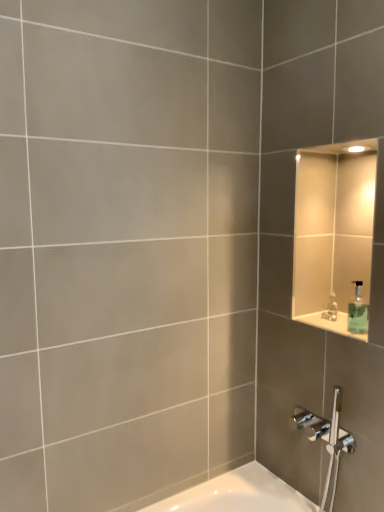
Question: Is green translucent soap dispenser at upper right at the right side of silver metallic faucet at upper right?

Choices:
 (A) no
 (B) yes

Answer: (B)

Question: Is green translucent soap dispenser at upper right further to the viewer compared to silver metallic faucet at upper right?

Choices:
 (A) no
 (B) yes

Answer: (A)

Question: Are green translucent soap dispenser at upper right and silver metallic faucet at upper right far apart?

Choices:
 (A) yes
 (B) no

Answer: (B)

Question: Does green translucent soap dispenser at upper right have a greater height compared to silver metallic faucet at upper right?

Choices:
 (A) yes
 (B) no

Answer: (A)

Question: Considering the relative positions of green translucent soap dispenser at upper right and silver metallic faucet at upper right in the image provided, is green translucent soap dispenser at upper right to the left of silver metallic faucet at upper right from the viewer's perspective?

Choices:
 (A) no
 (B) yes

Answer: (A)

Question: From the image's perspective, is green translucent soap dispenser at upper right on silver metallic faucet at upper right?

Choices:
 (A) no
 (B) yes

Answer: (B)

Question: Is silver metallic faucet at upper right touching green translucent soap dispenser at upper right?

Choices:
 (A) no
 (B) yes

Answer: (B)

Question: Considering the relative sizes of silver metallic faucet at upper right and green translucent soap dispenser at upper right in the image provided, is silver metallic faucet at upper right smaller than green translucent soap dispenser at upper right?

Choices:
 (A) no
 (B) yes

Answer: (B)

Question: From a real-world perspective, is silver metallic faucet at upper right on green translucent soap dispenser at upper right?

Choices:
 (A) yes
 (B) no

Answer: (B)

Question: From the image's perspective, would you say silver metallic faucet at upper right is shown under green translucent soap dispenser at upper right?

Choices:
 (A) yes
 (B) no

Answer: (A)

Question: Is silver metallic faucet at upper right positioned with its back to green translucent soap dispenser at upper right?

Choices:
 (A) no
 (B) yes

Answer: (A)

Question: Could you tell me if silver metallic faucet at upper right is turned towards green translucent soap dispenser at upper right?

Choices:
 (A) yes
 (B) no

Answer: (B)

Question: Choose the correct answer: Is green translucent soap dispenser at upper right inside silver metallic faucet at upper right or outside it?

Choices:
 (A) inside
 (B) outside

Answer: (B)